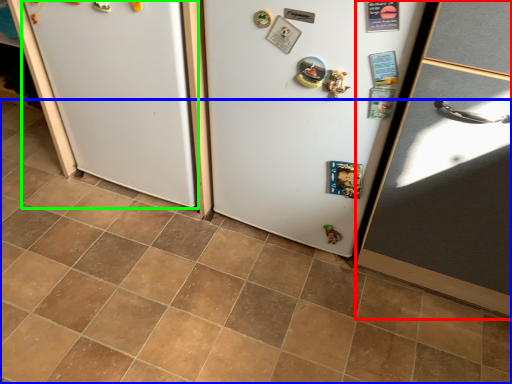
Question: Which object is the farthest from door (highlighted by a red box)? Choose among these: tile (highlighted by a blue box) or fridge (highlighted by a green box).

Choices:
 (A) tile
 (B) fridge

Answer: (B)